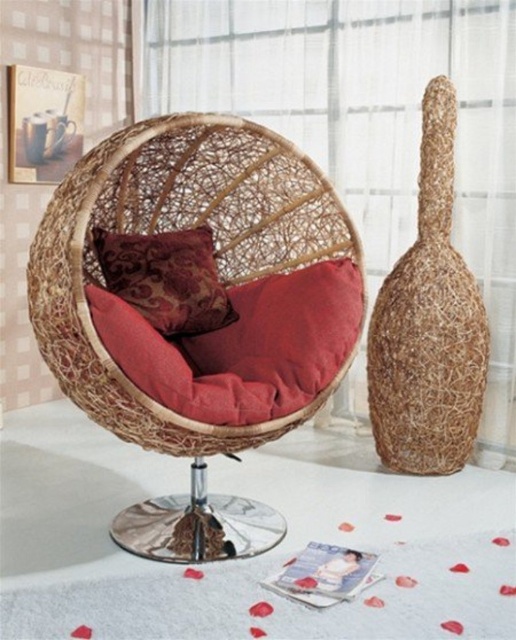
Does point (104, 296) come farther from viewer compared to point (121, 268)?

No, it is in front of (121, 268).

Which is more to the right, woven rattan armchair at center or velvet-like burgundy pillow at center?

woven rattan armchair at center

Describe the element at coordinates (197, 308) in the screenshot. This screenshot has height=640, width=516. I see `woven rattan armchair at center` at that location.

Find the location of a particular element. woven rattan armchair at center is located at coordinates (197, 308).